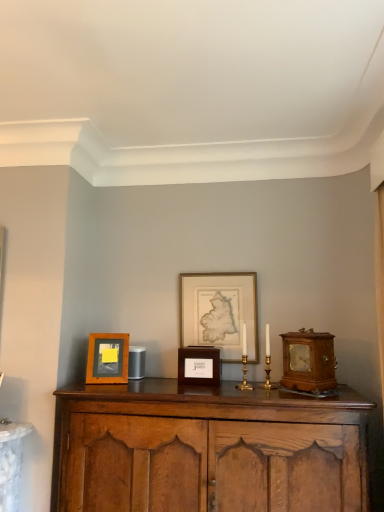
Question: Is wooden cabinet at center closer to camera compared to gold-framed map at center, the third picture frame when ordered from left to right?

Choices:
 (A) yes
 (B) no

Answer: (A)

Question: Does wooden cabinet at center contain gold-framed map at center, the third picture frame when ordered from left to right?

Choices:
 (A) yes
 (B) no

Answer: (B)

Question: Is wooden cabinet at center facing towards gold-framed map at center, the third picture frame when ordered from left to right?

Choices:
 (A) yes
 (B) no

Answer: (B)

Question: Does wooden cabinet at center lie behind gold-framed map at center, the third picture frame when ordered from left to right?

Choices:
 (A) no
 (B) yes

Answer: (A)

Question: Would you say wooden cabinet at center is a long distance from gold-framed map at center, the third picture frame when ordered from left to right?

Choices:
 (A) yes
 (B) no

Answer: (B)

Question: Would you say wooden cabinet at center is inside or outside gold-framed map at center, which is the first picture frame from right to left?

Choices:
 (A) outside
 (B) inside

Answer: (A)

Question: In terms of width, does wooden cabinet at center look wider or thinner when compared to gold-framed map at center, which is the first picture frame from right to left?

Choices:
 (A) wide
 (B) thin

Answer: (A)

Question: Is point (334, 489) closer or farther from the camera than point (235, 280)?

Choices:
 (A) closer
 (B) farther

Answer: (A)

Question: In terms of size, does wooden cabinet at center appear bigger or smaller than gold-framed map at center, the third picture frame when ordered from left to right?

Choices:
 (A) big
 (B) small

Answer: (A)

Question: Would you say wooden box at center, which is the second picture frame in right-to-left order, is to the left or to the right of wooden frame at left, the 1th picture frame positioned from the left, in the picture?

Choices:
 (A) left
 (B) right

Answer: (B)

Question: In the image, is wooden box at center, arranged as the second picture frame when viewed from the left, positioned in front of or behind wooden frame at left, the 1th picture frame positioned from the left?

Choices:
 (A) behind
 (B) front

Answer: (B)

Question: Is point (196, 380) closer or farther from the camera than point (94, 355)?

Choices:
 (A) farther
 (B) closer

Answer: (B)

Question: Considering the positions of wooden box at center, which is the second picture frame in right-to-left order, and wooden frame at left, the 1th picture frame positioned from the left, in the image, is wooden box at center, which is the second picture frame in right-to-left order, taller or shorter than wooden frame at left, the 1th picture frame positioned from the left,?

Choices:
 (A) short
 (B) tall

Answer: (A)

Question: From the image's perspective, is wooden alarm clock at right above or below wooden box at center, which is the second picture frame in right-to-left order?

Choices:
 (A) below
 (B) above

Answer: (B)

Question: In terms of size, does wooden alarm clock at right appear bigger or smaller than wooden box at center, which is the second picture frame in right-to-left order?

Choices:
 (A) small
 (B) big

Answer: (B)